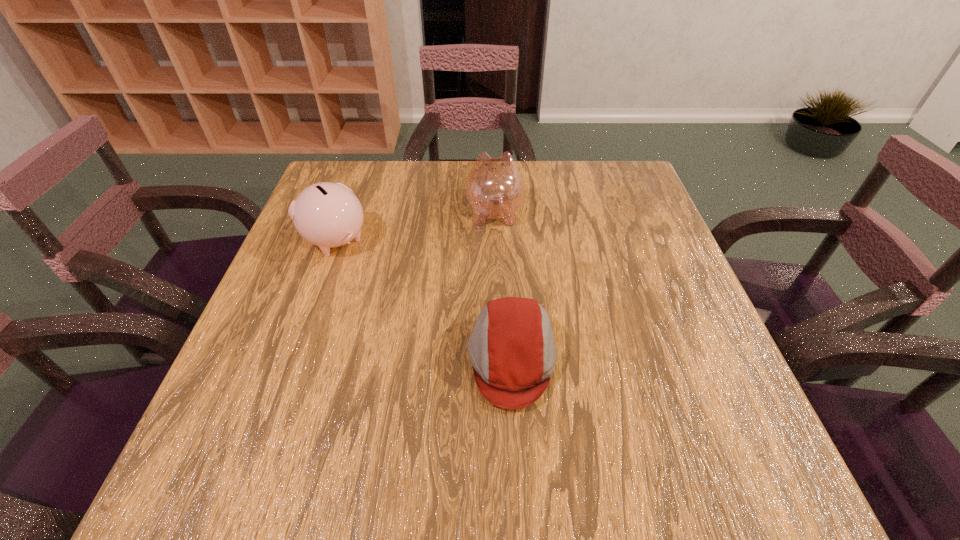
Locate an element on the screen. This screenshot has width=960, height=540. the right piggy bank is located at coordinates (494, 188).

This screenshot has height=540, width=960. In order to click on the left piggy bank in this screenshot , I will do `click(328, 215)`.

Image resolution: width=960 pixels, height=540 pixels. In order to click on the nearest object in this screenshot , I will do `click(512, 350)`.

At what (x,y) coordinates should I click in order to perform the action: click on the shortest object. Please return your answer as a coordinate pair (x, y). Looking at the image, I should click on (512, 350).

This screenshot has width=960, height=540. What are the coordinates of `vacant space located 0.170m on the front facing side of the right piggy bank` in the screenshot? It's located at (492, 161).

Locate an element on the screen. blank space located on the front facing side of the right piggy bank is located at coordinates (493, 179).

The image size is (960, 540). In order to click on vacant point located 0.130m on the back of the leftmost object in this screenshot , I will do `click(353, 190)`.

Where is `free spot located on the front-facing side of the cap`? free spot located on the front-facing side of the cap is located at coordinates (300, 359).

At what (x,y) coordinates should I click in order to perform the action: click on vacant position located on the front-facing side of the cap. Please return your answer as a coordinate pair (x, y). This screenshot has height=540, width=960. Looking at the image, I should click on (354, 359).

I want to click on vacant region located 0.370m on the front-facing side of the cap, so click(x=269, y=359).